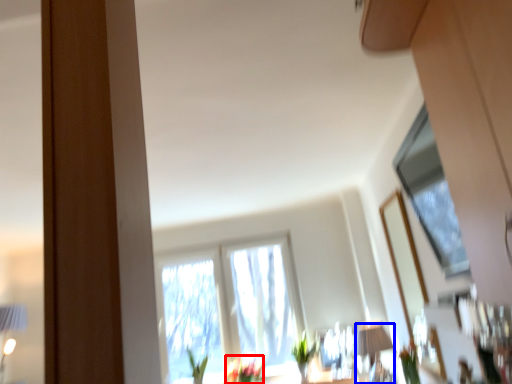
Question: Which of the following is the farthest to the observer, flower (highlighted by a red box) or table lamp (highlighted by a blue box)?

Choices:
 (A) flower
 (B) table lamp

Answer: (A)